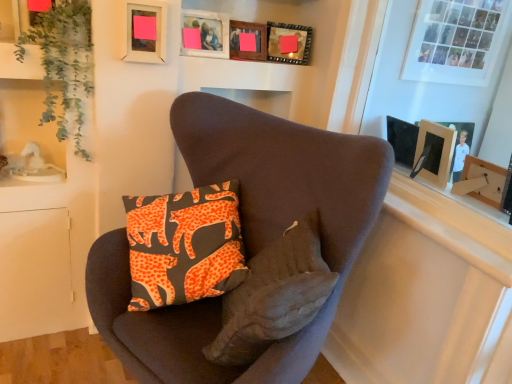
Question: From the image's perspective, does matte white photo frame at upper right appear lower than matte wooden picture frame at upper center, which is counted as the 2th picture frame, starting from the left?

Choices:
 (A) yes
 (B) no

Answer: (B)

Question: Is matte wooden picture frame at upper center, the 3th picture frame positioned from the right, located within matte white photo frame at upper right?

Choices:
 (A) yes
 (B) no

Answer: (B)

Question: Considering the relative positions of matte white photo frame at upper right and matte wooden picture frame at upper center, the 3th picture frame positioned from the right, in the image provided, is matte white photo frame at upper right to the left of matte wooden picture frame at upper center, the 3th picture frame positioned from the right, from the viewer's perspective?

Choices:
 (A) no
 (B) yes

Answer: (A)

Question: Is matte white photo frame at upper right outside of matte wooden picture frame at upper center, the 3th picture frame positioned from the right?

Choices:
 (A) no
 (B) yes

Answer: (B)

Question: From a real-world perspective, is matte white photo frame at upper right over matte wooden picture frame at upper center, which is counted as the 2th picture frame, starting from the left?

Choices:
 (A) yes
 (B) no

Answer: (A)

Question: Is matte white photo frame at upper right wider than matte wooden picture frame at upper center, the 3th picture frame positioned from the right?

Choices:
 (A) no
 (B) yes

Answer: (B)

Question: Considering the relative sizes of matte white photo frame at upper right and velvet brown armchair at center in the image provided, is matte white photo frame at upper right shorter than velvet brown armchair at center?

Choices:
 (A) no
 (B) yes

Answer: (B)

Question: Does matte white photo frame at upper right come behind velvet brown armchair at center?

Choices:
 (A) yes
 (B) no

Answer: (A)

Question: Can you confirm if matte white photo frame at upper right is taller than velvet brown armchair at center?

Choices:
 (A) no
 (B) yes

Answer: (A)

Question: Is matte white photo frame at upper right positioned with its back to velvet brown armchair at center?

Choices:
 (A) no
 (B) yes

Answer: (A)

Question: From a real-world perspective, is matte white photo frame at upper right positioned over velvet brown armchair at center based on gravity?

Choices:
 (A) yes
 (B) no

Answer: (A)

Question: From a real-world perspective, is matte white photo frame at upper right positioned under velvet brown armchair at center based on gravity?

Choices:
 (A) no
 (B) yes

Answer: (A)

Question: Can you confirm if wooden picture frame at upper center, the 2th picture frame from the right, is thinner than matte wooden picture frame at upper center, which is counted as the 2th picture frame, starting from the left?

Choices:
 (A) no
 (B) yes

Answer: (B)